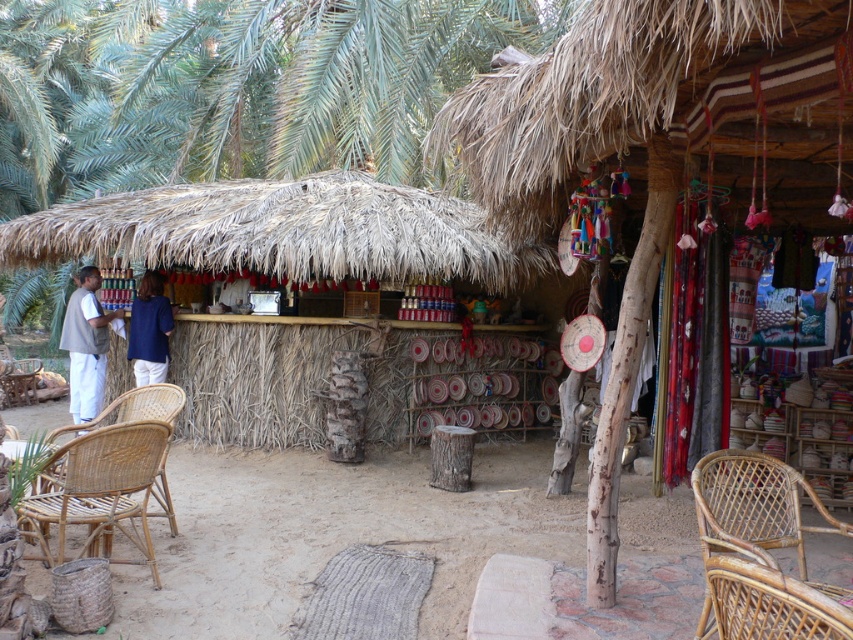
You are setting up a small booth at the market and need to place both the natural wicker chair at lower left and the blue fabric shirt at center. If the space you have is only wide enough for the narrower of the two items, which item should you choose?

The blue fabric shirt at center should be chosen because the natural wicker chair at lower left is wider, so the narrower item is the blue fabric shirt at center.

You are setting up a small booth for a craft fair and need to place the rattan chair at lower right and the light brown fabric vest at left. Given the space constraints, which object requires more horizontal space?

The rattan chair at lower right requires more horizontal space because its width surpasses that of the light brown fabric vest at left.

You are a customer at the stall and want to sit down. There is a rattan chair at lower right and a light brown fabric vest at left. Which object is closer to the ground?

The rattan chair at lower right is closer to the ground because it is below the light brown fabric vest at left.